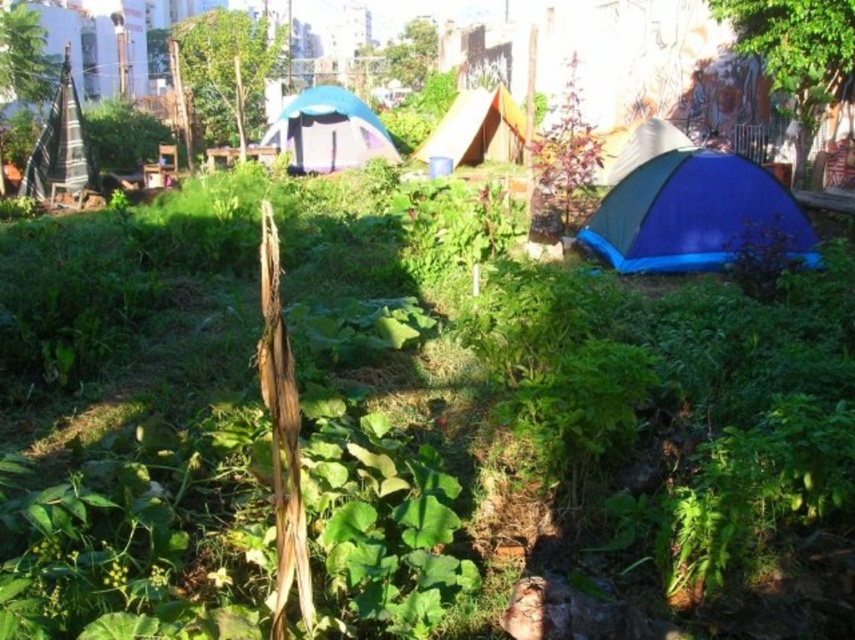
Is blue fabric tent at center above white fabric tent at center?

Yes.

Does blue fabric tent at center have a greater width compared to white fabric tent at center?

Correct, the width of blue fabric tent at center exceeds that of white fabric tent at center.

Who is more distant from viewer, (357, 129) or (677, 140)?

The point (357, 129) is behind.

Find the location of a particular element. This screenshot has height=640, width=855. blue fabric tent at center is located at coordinates (329, 131).

Who is more forward, (304, 93) or (511, 147)?

Point (511, 147)

Which is in front, point (313, 154) or point (488, 160)?

Point (313, 154) is more forward.

This screenshot has width=855, height=640. What are the coordinates of `blue fabric tent at center` in the screenshot? It's located at (329, 131).

Is blue fabric tent at center-right to the left of blue fabric tent at center from the viewer's perspective?

Incorrect, blue fabric tent at center-right is not on the left side of blue fabric tent at center.

Can you confirm if blue fabric tent at center-right is thinner than blue fabric tent at center?

Yes.

Is point (623, 216) positioned in front of point (313, 131)?

That is True.

Where is `blue fabric tent at center-right`? This screenshot has height=640, width=855. blue fabric tent at center-right is located at coordinates (694, 214).